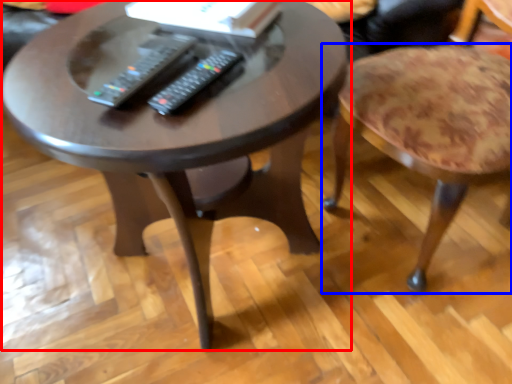
Question: Among these objects, which one is farthest to the camera, coffee table (highlighted by a red box) or stool (highlighted by a blue box)?

Choices:
 (A) coffee table
 (B) stool

Answer: (B)